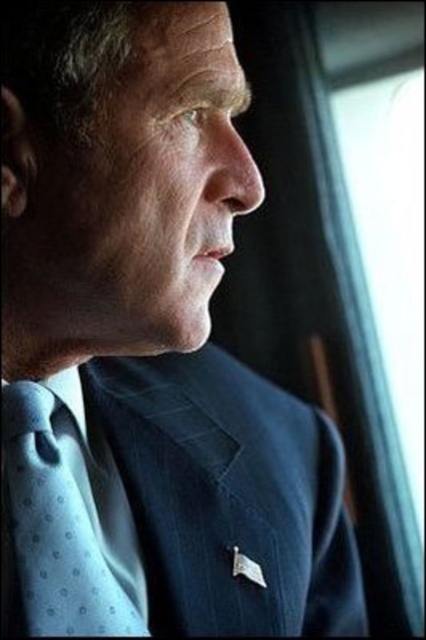
You are an assistant helping someone dress for an interview. The person has a dark blue textured suit at center and a light blue dotted fabric tie at center. Which item is closer to the person when they are trying it on?

The dark blue textured suit at center is closer to the person than the light blue dotted fabric tie at center when trying it on because it is positioned further to the viewer.

You are a tailor measuring the distance between the dark blue textured suit at center and the light blue dotted fabric tie at center for a custom alteration. The minimum required distance for proper fitting is 15 centimeters. Is the current distance sufficient?

The dark blue textured suit at center is 14.40 centimeters from light blue dotted fabric tie at center, which is less than the required 15 centimeters. Therefore, the current distance is insufficient for proper fitting.

You are an interior designer analyzing the lighting in the room. You notice two points of light in the image at coordinates point [124,438] and point [121,589]. Which point is closer to the window that is providing the natural light?

Point [121,589] is closer to the window because it is in front of point [124,438], which is behind it.